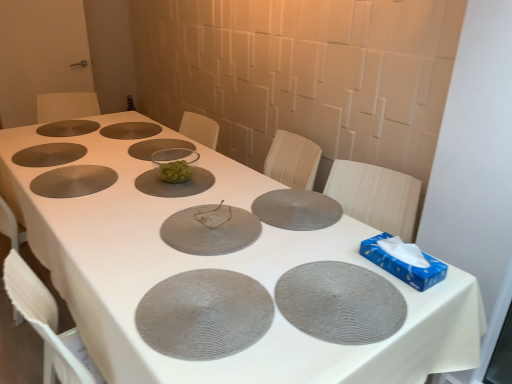
The width and height of the screenshot is (512, 384). I want to click on vacant area situated to the left side of gray textured placemat at center, positioned as the 10th glass plate in back-to-front order, so click(x=113, y=275).